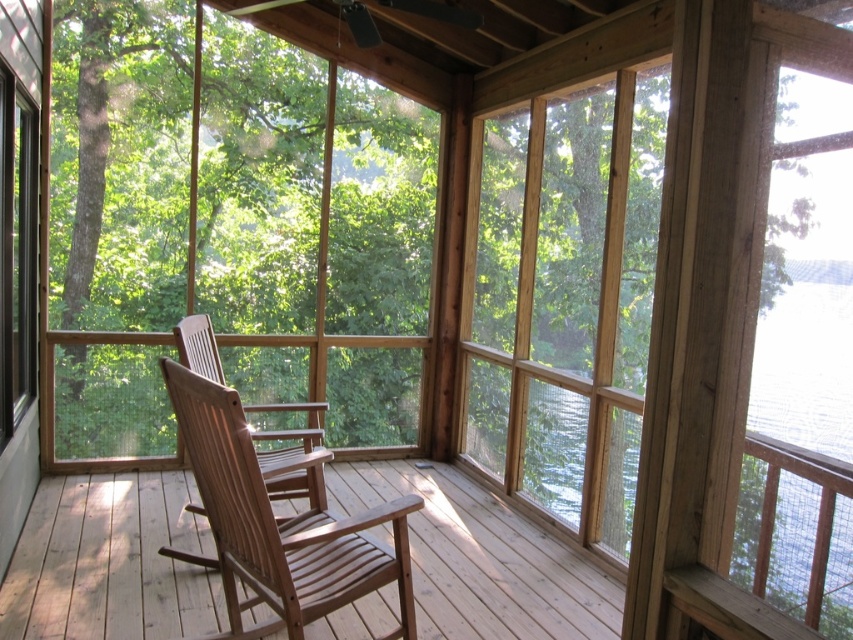
Question: Is clear glass window at center above clear glass water at right?

Choices:
 (A) yes
 (B) no

Answer: (A)

Question: Is light brown wooden rocking chair at center to the left of clear glass water at right from the viewer's perspective?

Choices:
 (A) yes
 (B) no

Answer: (A)

Question: Can you confirm if light brown wood rocking chair at center is positioned below light brown wooden rocking chair at center?

Choices:
 (A) yes
 (B) no

Answer: (A)

Question: Based on their relative distances, which object is farther from the light brown wooden rocking chair at center?

Choices:
 (A) clear glass window at center
 (B) clear glass water at right

Answer: (A)

Question: Which of the following is the farthest from the observer?

Choices:
 (A) clear glass window at center
 (B) clear glass water at right

Answer: (A)

Question: Estimate the real-world distances between objects in this image. Which object is farther from the light brown wood rocking chair at center?

Choices:
 (A) light brown wooden rocking chair at center
 (B) clear glass water at right

Answer: (B)